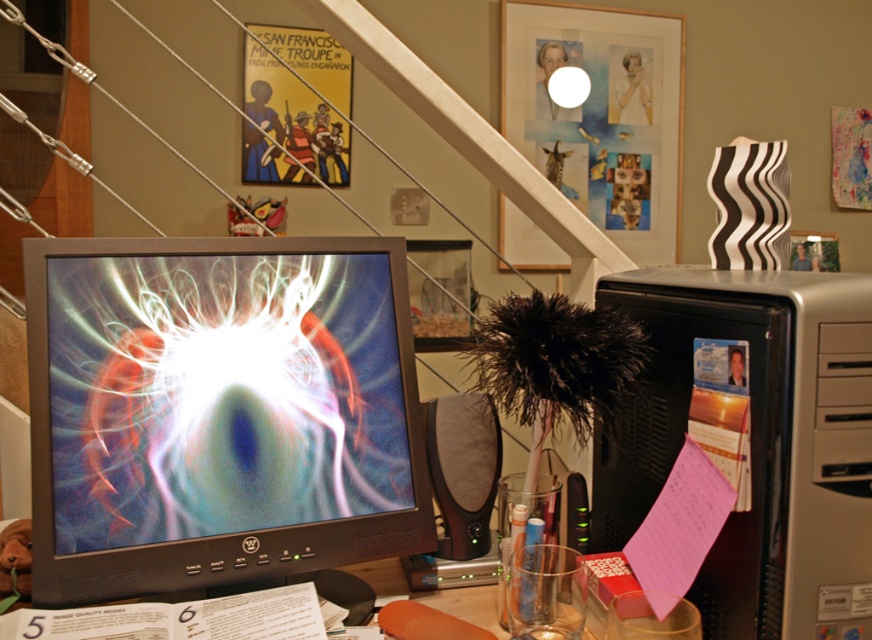
Question: In this image, where is matte black monitor at center located relative to silver metallic computer tower at right?

Choices:
 (A) right
 (B) left

Answer: (B)

Question: Which object is farther from the camera taking this photo?

Choices:
 (A) silver metallic computer tower at right
 (B) matte black monitor at center

Answer: (B)

Question: Can you confirm if matte black monitor at center is thinner than silver metallic computer tower at right?

Choices:
 (A) yes
 (B) no

Answer: (B)

Question: Is matte black monitor at center behind silver metallic computer tower at right?

Choices:
 (A) yes
 (B) no

Answer: (A)